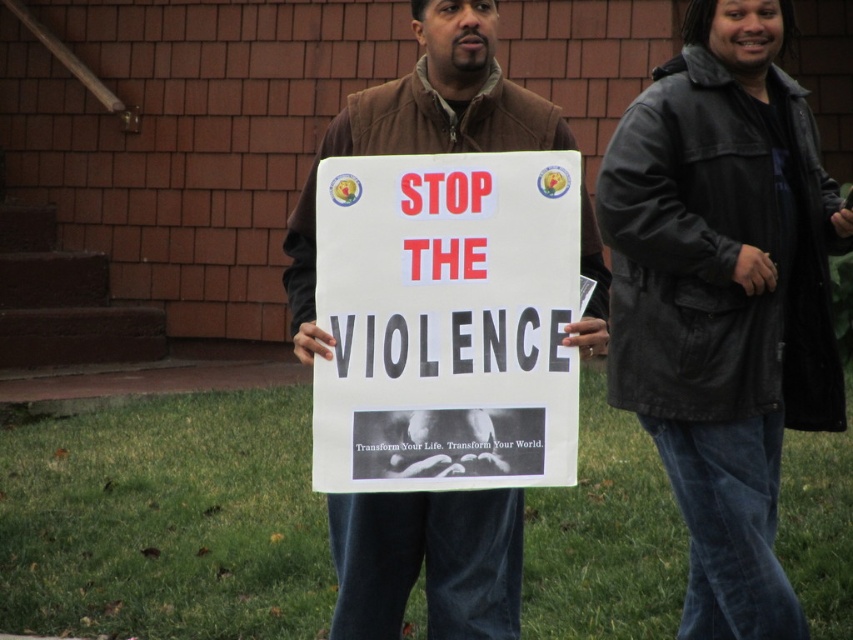
You are a photographer trying to capture a clear shot of the white paper sign at center and the brown leather jacket at center. Based on their positions, which object is closer to the camera?

The white paper sign at center is below the brown leather jacket at center, so the brown leather jacket at center is closer to the camera.